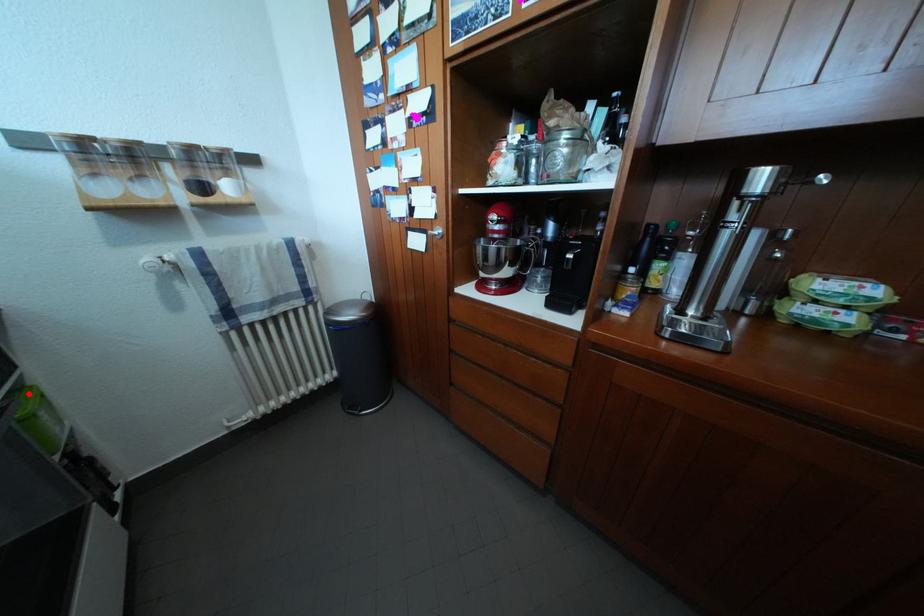
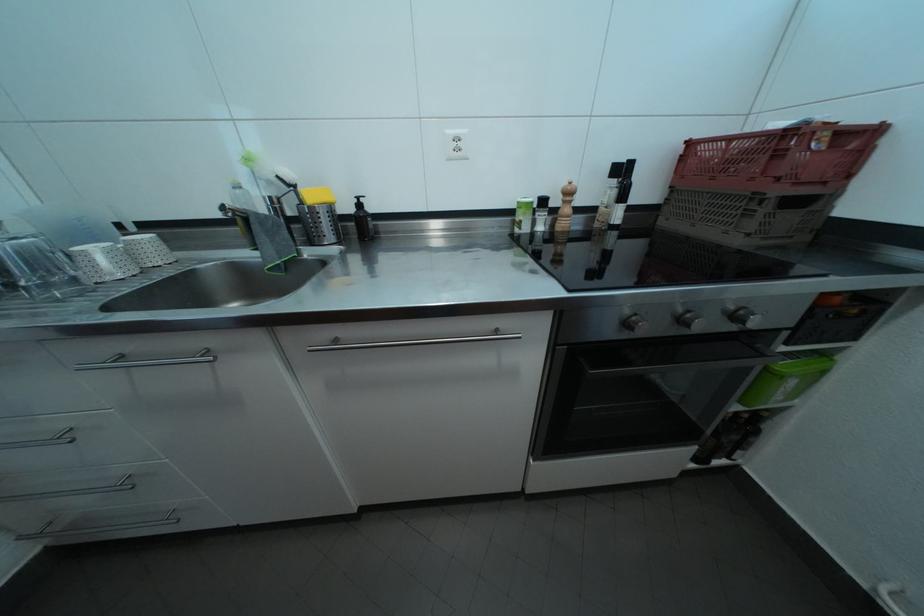
Question: I am providing you with two images of the same scene from different viewpoints. Image1 has a red point marked. In image2, the corresponding 3D location appears at what relative position? Reply with the corresponding letter.

Choices:
 (A) Closer
 (B) Farther

Answer: (A)